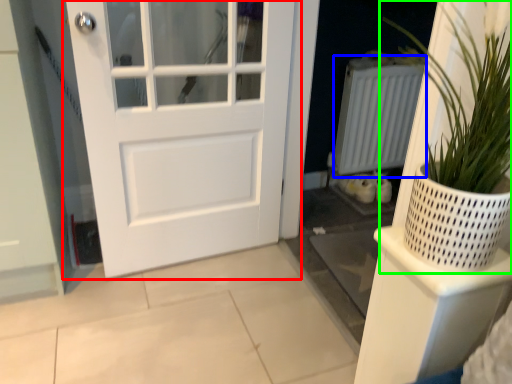
Question: Estimate the real-world distances between objects in this image. Which object is farther from door (highlighted by a red box), radiator (highlighted by a blue box) or houseplant (highlighted by a green box)?

Choices:
 (A) radiator
 (B) houseplant

Answer: (B)